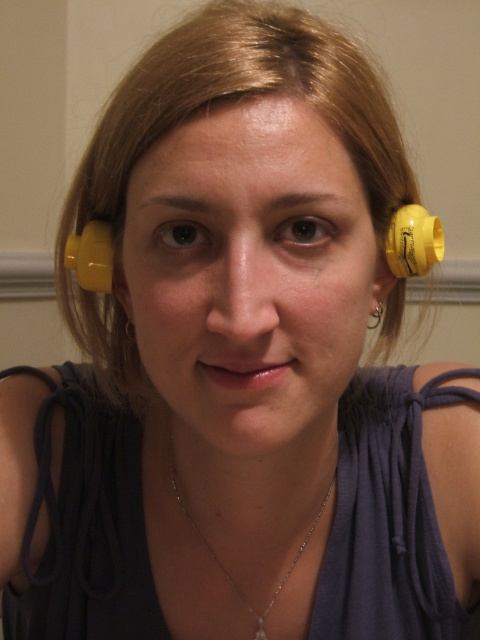
Which of these two, yellow matte ear at right or yellow matte ear at left, stands taller?

yellow matte ear at left

Can you confirm if yellow matte ear at right is smaller than yellow matte ear at left?

Actually, yellow matte ear at right might be larger than yellow matte ear at left.

Locate an element on the screen. This screenshot has width=480, height=640. yellow matte ear at right is located at coordinates (380, 285).

You are a GUI agent. You are given a task and a screenshot of the screen. Output one action in this format:
    pyautogui.click(x=<x>, y=<y>)
    Task: Click on the yellow matte ear at right
    
    Given the screenshot: What is the action you would take?
    pyautogui.click(x=380, y=285)

Can you confirm if silver chain necklace at center is wider than silver metallic ring at ear?

Indeed, silver chain necklace at center has a greater width compared to silver metallic ring at ear.

Which is in front, point (334, 477) or point (382, 314)?

Point (382, 314) is more forward.

Is point (196, 528) closer to viewer compared to point (380, 320)?

No, it is behind (380, 320).

This screenshot has width=480, height=640. Find the location of `silver chain necklace at center`. silver chain necklace at center is located at coordinates (222, 563).

Does silver chain necklace at center appear over yellow matte ear at left?

Actually, silver chain necklace at center is below yellow matte ear at left.

Between point (177, 477) and point (128, 308), which one is positioned in front?

Positioned in front is point (128, 308).

At what (x,y) coordinates should I click in order to perform the action: click on silver chain necklace at center. Please return your answer as a coordinate pair (x, y). Looking at the image, I should click on point(222,563).